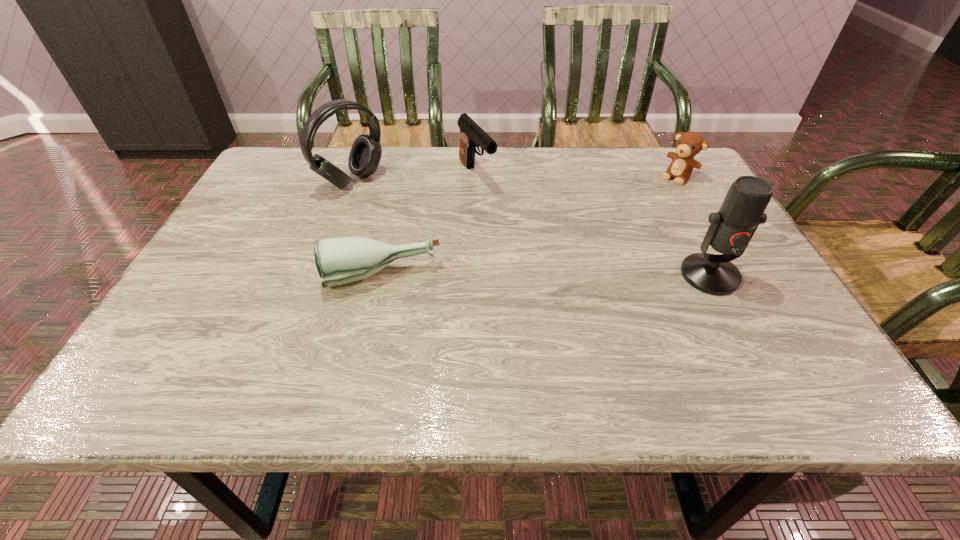
Find the location of `bottle`. bottle is located at coordinates (342, 260).

The image size is (960, 540). I want to click on microphone, so coord(732,227).

Where is `the third shortest object`? This screenshot has width=960, height=540. the third shortest object is located at coordinates (472, 135).

The height and width of the screenshot is (540, 960). What are the coordinates of `pistol` in the screenshot? It's located at (472, 135).

What are the coordinates of `teddy bear` in the screenshot? It's located at (689, 144).

Locate an element on the screen. headset is located at coordinates (365, 155).

Locate an element on the screen. This screenshot has height=540, width=960. free region located on the right of the shortest object is located at coordinates (553, 276).

The image size is (960, 540). Identify the location of vacant space situated 0.080m on the side of the microphone with the red ring. (736, 327).

Where is `free space located 0.270m at the barrel of the pistol`? The height and width of the screenshot is (540, 960). free space located 0.270m at the barrel of the pistol is located at coordinates (538, 252).

Where is `vacant space located 0.390m at the barrel of the pistol`? This screenshot has width=960, height=540. vacant space located 0.390m at the barrel of the pistol is located at coordinates (567, 287).